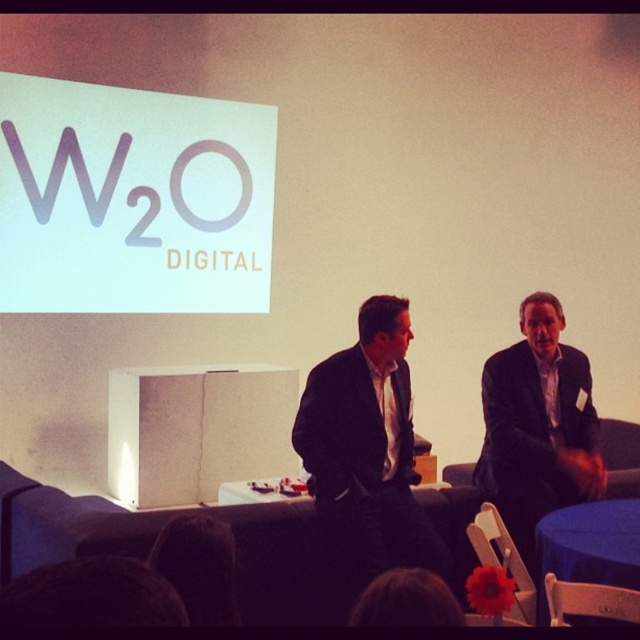
Question: Which object is positioned farthest from the blue fabric table at lower right?

Choices:
 (A) white paper at upper left
 (B) dark suit at center
 (C) black suit at center

Answer: (A)

Question: Can you confirm if black suit at center is thinner than dark suit at center?

Choices:
 (A) yes
 (B) no

Answer: (B)

Question: Which point appears closest to the camera in this image?

Choices:
 (A) (208, 264)
 (B) (561, 474)
 (C) (369, 406)
 (D) (568, 550)

Answer: (D)

Question: Which of the following is the farthest from the observer?

Choices:
 (A) blue fabric table at lower right
 (B) white paper at upper left
 (C) black suit at center

Answer: (B)

Question: Can you confirm if black suit at center is positioned above dark suit at center?

Choices:
 (A) yes
 (B) no

Answer: (B)

Question: Is black suit at center smaller than dark suit at center?

Choices:
 (A) no
 (B) yes

Answer: (B)